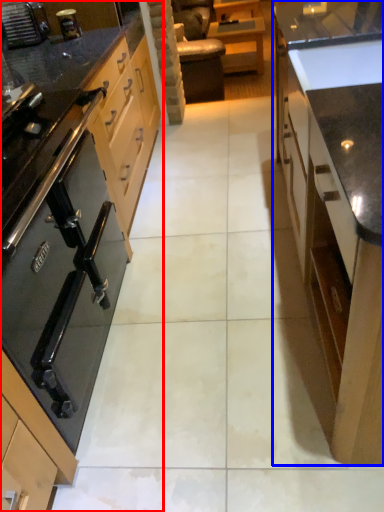
Question: Among these objects, which one is farthest to the camera, cabinetry (highlighted by a red box) or cabinetry (highlighted by a blue box)?

Choices:
 (A) cabinetry
 (B) cabinetry

Answer: (A)